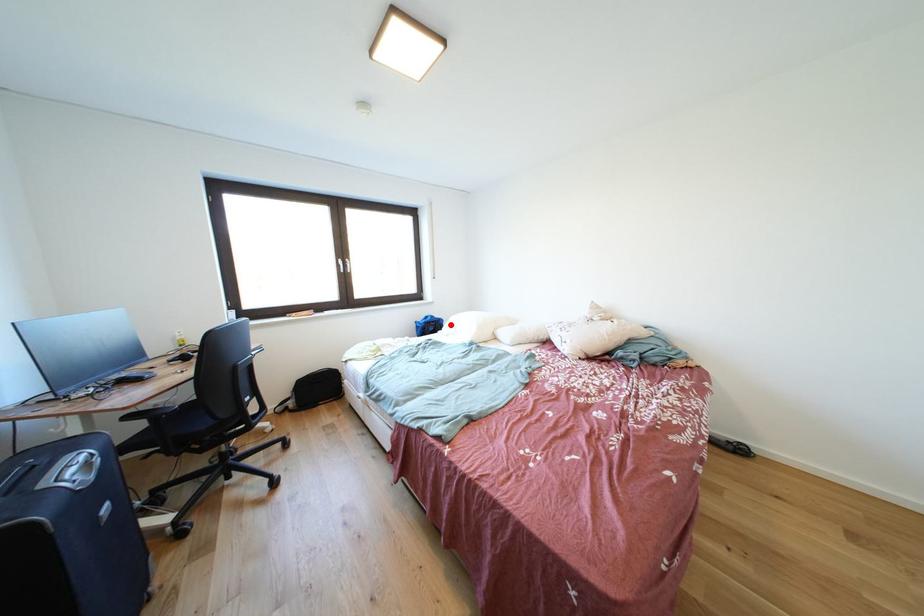
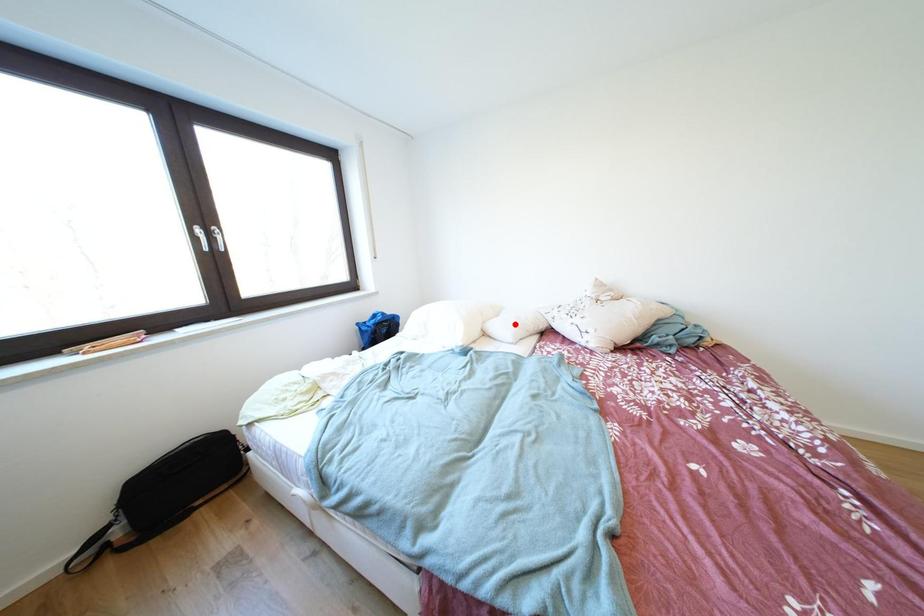
I am providing you with two images of the same scene from different viewpoints. A red point is marked on the first image and another point is marked on the second image. Is the red point in image1 aligned with the point shown in image2?

No